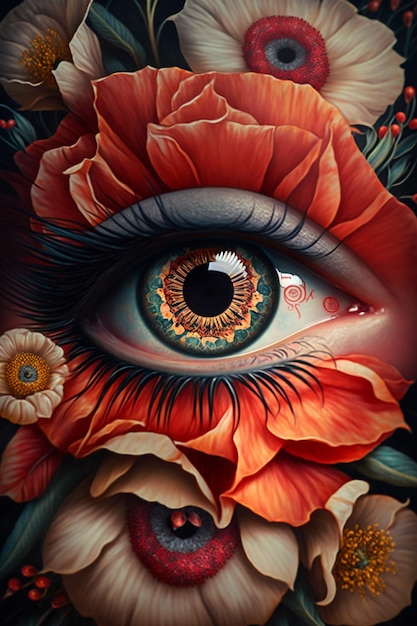
Where is `art piece`? This screenshot has width=417, height=626. art piece is located at coordinates (346, 354).